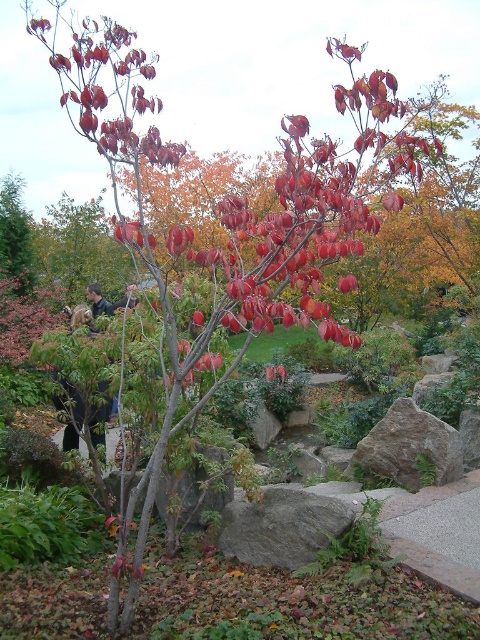
Is gray rough rock at center above green matte tree at left?

Actually, gray rough rock at center is below green matte tree at left.

Between point (280, 556) and point (1, 227), which one is positioned in front?

Point (280, 556) is more forward.

Describe the element at coordinates (282, 525) in the screenshot. This screenshot has height=640, width=480. I see `gray rough rock at center` at that location.

Locate an element on the screen. The height and width of the screenshot is (640, 480). gray rough rock at center is located at coordinates (282, 525).

Between gray rough rock at lower right and green matte tree at left, which one appears on the right side from the viewer's perspective?

gray rough rock at lower right

Locate an element on the screen. This screenshot has width=480, height=640. gray rough rock at lower right is located at coordinates (408, 449).

Find the location of a particular element. Image resolution: width=480 pixels, height=640 pixels. gray rough rock at lower right is located at coordinates (408, 449).

Does gray rough rock at center have a greater height compared to gray rough rock at lower right?

No, gray rough rock at center is not taller than gray rough rock at lower right.

Does gray rough rock at center have a lesser width compared to gray rough rock at lower right?

Indeed, gray rough rock at center has a lesser width compared to gray rough rock at lower right.

Is point (228, 522) farther from viewer compared to point (455, 465)?

No, it is not.

Where is `gray rough rock at center`? gray rough rock at center is located at coordinates (282, 525).